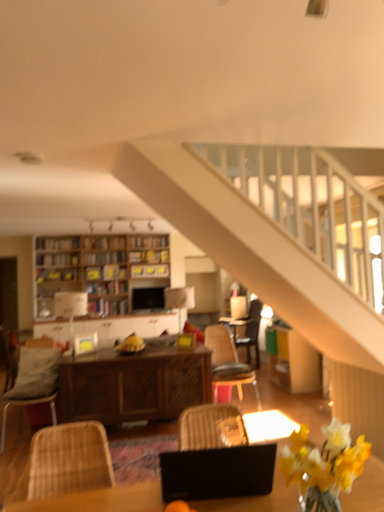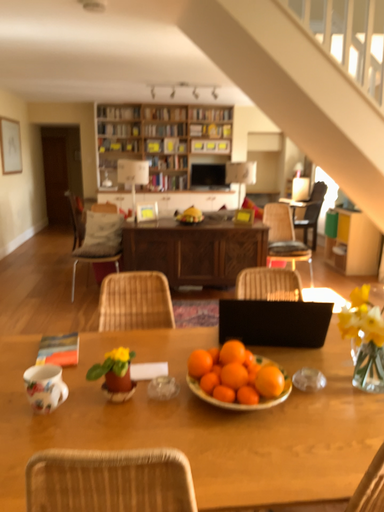
Question: How did the camera likely rotate when shooting the video?

Choices:
 (A) rotated upward
 (B) rotated downward

Answer: (B)